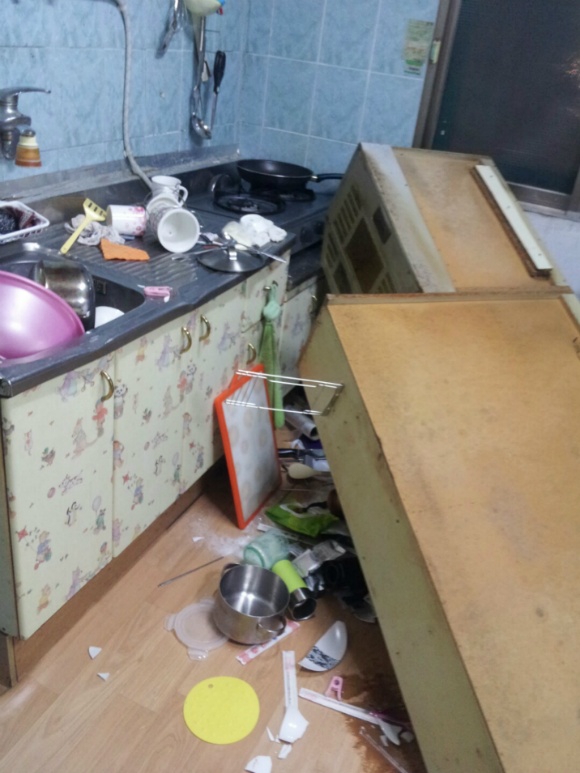
I want to click on cooking pot, so click(x=246, y=611).